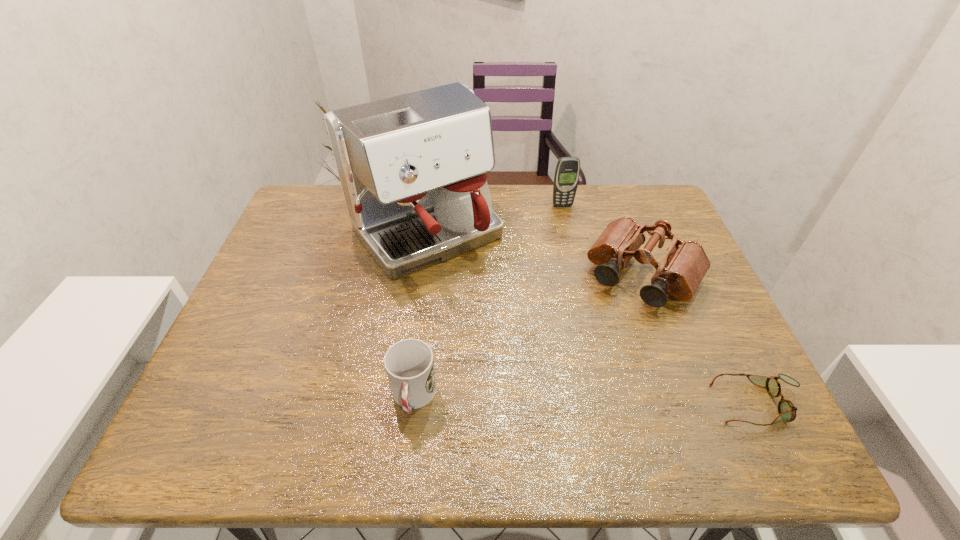
Where is `free space between the third tallest object and the cup`? This screenshot has height=540, width=960. free space between the third tallest object and the cup is located at coordinates (528, 336).

What are the coordinates of `unoccupied area between the coffee maker and the second shortest object` in the screenshot? It's located at (420, 315).

You are a GUI agent. You are given a task and a screenshot of the screen. Output one action in this format:
    pyautogui.click(x=<x>, y=<y>)
    Task: Click on the vacant area between the binoculars and the shortest object
    This screenshot has width=960, height=540.
    Given the screenshot: What is the action you would take?
    pyautogui.click(x=700, y=340)

Image resolution: width=960 pixels, height=540 pixels. In order to click on vacant space that's between the fourth tallest object and the tallest object in this screenshot , I will do `click(420, 315)`.

I want to click on vacant region between the tallest object and the third tallest object, so click(535, 254).

Identify the location of free space that is in between the binoculars and the cup. This screenshot has width=960, height=540. (528, 336).

You are a GUI agent. You are given a task and a screenshot of the screen. Output one action in this format:
    pyautogui.click(x=<x>, y=<y>)
    Task: Click on the unoccupied area between the shortest object and the third shortest object
    This screenshot has width=960, height=540.
    Given the screenshot: What is the action you would take?
    pyautogui.click(x=700, y=340)

Locate an element on the screen. object that is the second closest to the fourth shortest object is located at coordinates (412, 167).

Identify which object is located as the third nearest to the coffee maker. Please provide its 2D coordinates. Your answer should be formatted as a tuple, i.e. [(x, y)], where the tuple contains the x and y coordinates of a point satisfying the conditions above.

[(409, 364)]

Image resolution: width=960 pixels, height=540 pixels. I want to click on free space that satisfies the following two spatial constraints: 1. on the front side of the third tallest object; 2. on the left side of the coffee maker, so click(x=420, y=275).